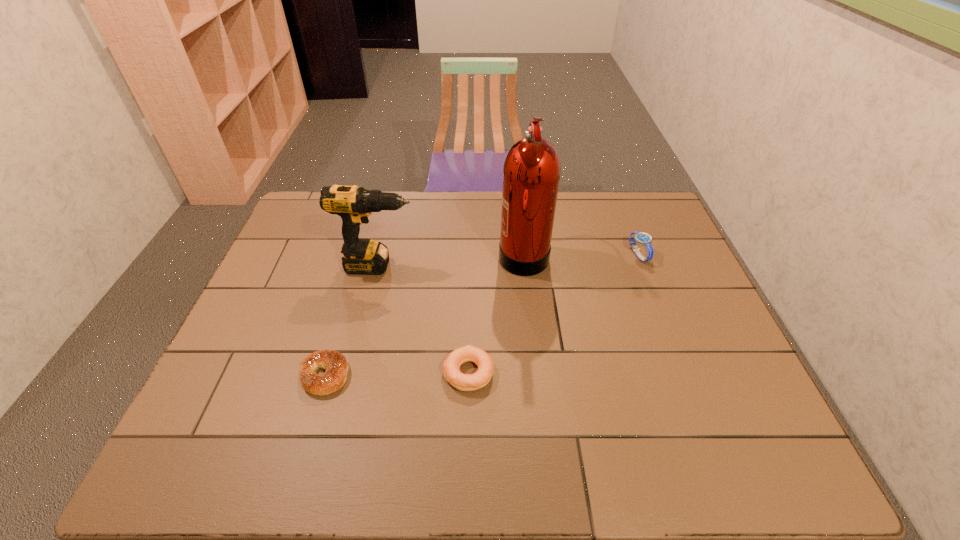
Identify the location of vacant space at the near left corner. This screenshot has width=960, height=540. (181, 451).

Find the location of a particular element. Image resolution: width=960 pixels, height=540 pixels. blank space at the far right corner of the desktop is located at coordinates (623, 195).

Find the location of `free space between the left bagel and the right bagel`. free space between the left bagel and the right bagel is located at coordinates (396, 374).

Identify the location of vacant area that lies between the tallest object and the drill. (451, 259).

Where is `free space between the second tallest object and the right bagel`? free space between the second tallest object and the right bagel is located at coordinates pyautogui.click(x=423, y=319).

Where is `blank region between the left bagel and the third tallest object`? Image resolution: width=960 pixels, height=540 pixels. blank region between the left bagel and the third tallest object is located at coordinates (481, 315).

Locate an element on the screen. The width and height of the screenshot is (960, 540). unoccupied position between the drill and the left bagel is located at coordinates click(351, 320).

Identify the location of vacant point located between the left bagel and the rightmost object. (481, 315).

At what (x,y) coordinates should I click in order to perform the action: click on free space between the second object from right to left and the left bagel. Please return your answer as a coordinate pair (x, y). This screenshot has width=960, height=540. Looking at the image, I should click on (423, 314).

Identify the location of vacant space in between the left bagel and the right bagel. (396, 374).